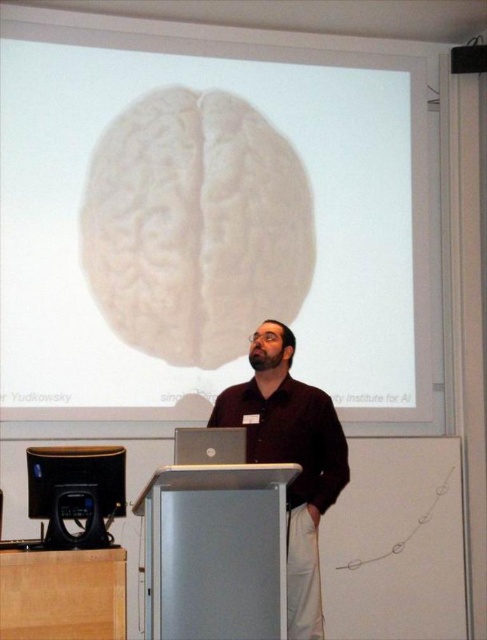
Question: Estimate the real-world distances between objects in this image. Which object is closer to the white matte projection screen at upper center?

Choices:
 (A) black glossy monitor at lower left
 (B) dark brown shirt at center

Answer: (B)

Question: Can you confirm if white matte projection screen at upper center is bigger than dark brown shirt at center?

Choices:
 (A) no
 (B) yes

Answer: (B)

Question: Where is black glossy monitor at lower left located in relation to silver metallic laptop at center in the image?

Choices:
 (A) above
 (B) below

Answer: (B)

Question: Is dark brown shirt at center bigger than black glossy monitor at lower left?

Choices:
 (A) yes
 (B) no

Answer: (A)

Question: Which object is the farthest from the black glossy monitor at lower left?

Choices:
 (A) dark brown shirt at center
 (B) white matte projection screen at upper center
 (C) silver metallic laptop at center

Answer: (B)

Question: Among these objects, which one is nearest to the camera?

Choices:
 (A) silver metallic laptop at center
 (B) dark brown shirt at center
 (C) white matte projection screen at upper center
 (D) black glossy monitor at lower left

Answer: (B)